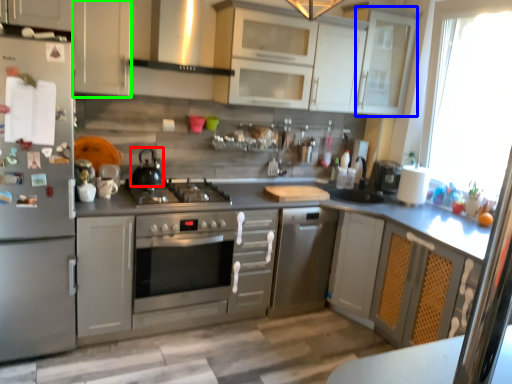
Question: Considering the real-world distances, which object is farthest from kitchen appliance (highlighted by a red box)? glass door (highlighted by a blue box) or cabinetry (highlighted by a green box)?

Choices:
 (A) glass door
 (B) cabinetry

Answer: (A)